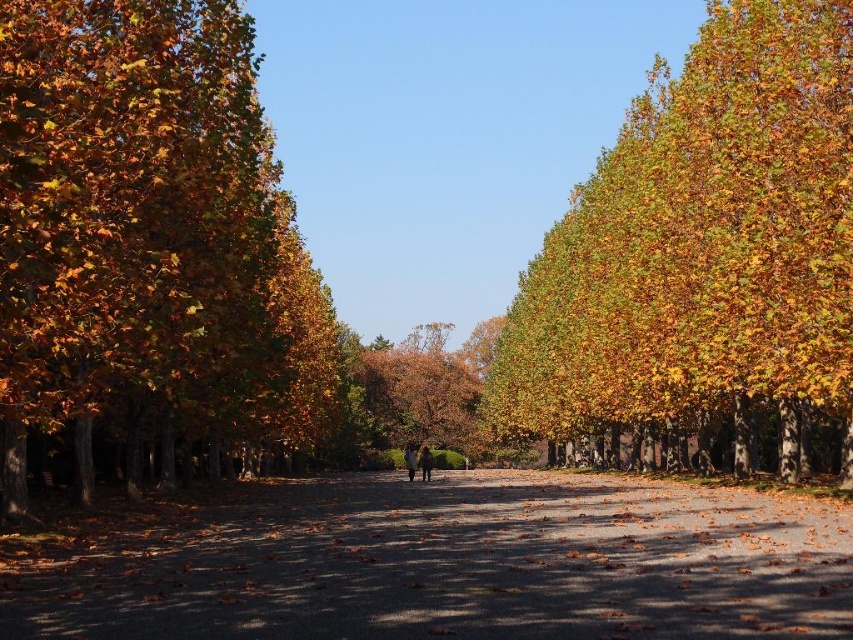
Question: Which point is closer to the camera?

Choices:
 (A) (44, 182)
 (B) (718, 234)

Answer: (A)

Question: Does golden leafy tree at left come in front of golden yellow leaves at upper right?

Choices:
 (A) yes
 (B) no

Answer: (A)

Question: Considering the real-world distances, which object is closest to the brown gravel path at center?

Choices:
 (A) golden leafy tree at left
 (B) golden yellow leaves at upper right
 (C) golden leafy tree at center

Answer: (A)

Question: Where is golden leafy tree at left located in relation to brown gravel path at center in the image?

Choices:
 (A) right
 (B) left

Answer: (B)

Question: Which object is closer to the camera taking this photo?

Choices:
 (A) brown gravel path at center
 (B) golden yellow leaves at upper right

Answer: (A)

Question: Is golden leafy tree at left bigger than brown gravel path at center?

Choices:
 (A) yes
 (B) no

Answer: (A)